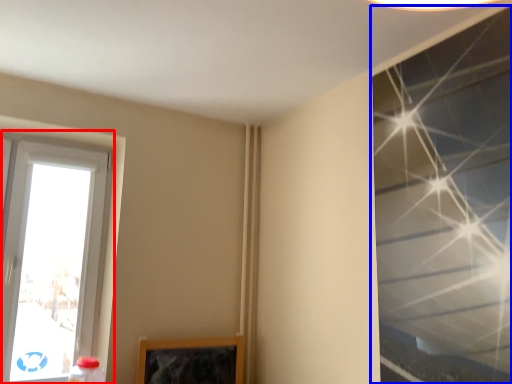
Question: Among these objects, which one is farthest to the camera, window (highlighted by a red box) or window (highlighted by a blue box)?

Choices:
 (A) window
 (B) window

Answer: (A)